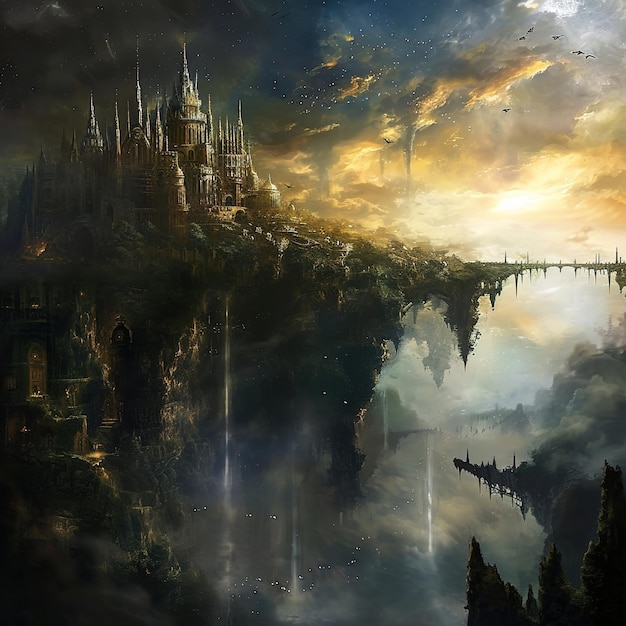
Where is `door`? The width and height of the screenshot is (626, 626). door is located at coordinates (34, 379).